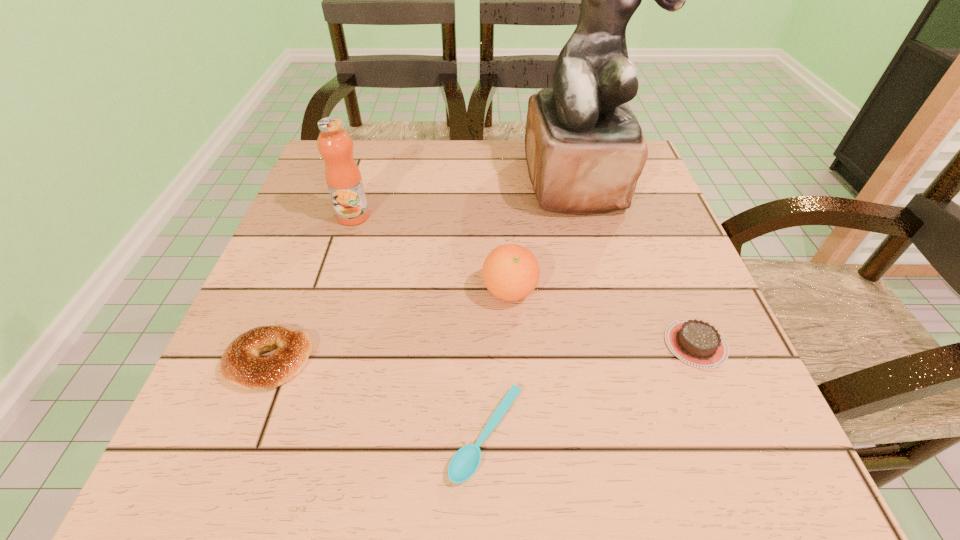
This screenshot has width=960, height=540. In order to click on sculpture in this screenshot , I will do `click(585, 150)`.

Locate an element on the screen. fruit juice is located at coordinates (343, 177).

I want to click on the fourth shortest object, so click(x=511, y=272).

In order to click on orange in this screenshot , I will do `click(511, 272)`.

Where is `the fourth tallest object`? the fourth tallest object is located at coordinates (241, 365).

The height and width of the screenshot is (540, 960). Identify the location of chocolate cake. (697, 343).

This screenshot has width=960, height=540. I want to click on the shortest object, so click(x=463, y=465).

This screenshot has height=540, width=960. I want to click on vacant position located 0.280m in a relaxed pose on the sculpture, so click(x=616, y=320).

Find the location of a particular element. This screenshot has height=540, width=960. free region located on the right of the second tallest object is located at coordinates (401, 217).

The height and width of the screenshot is (540, 960). Find the location of `blank area located 0.060m on the left of the third farthest object`. blank area located 0.060m on the left of the third farthest object is located at coordinates (449, 291).